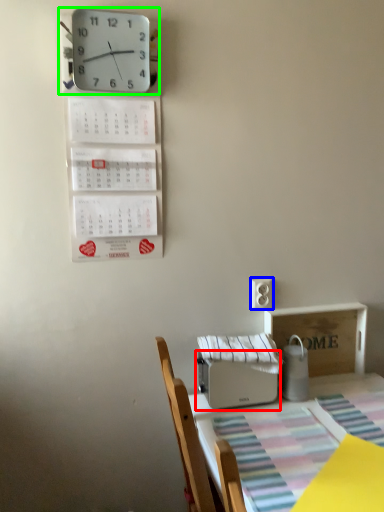
Question: Considering the real-world distances, which object is farthest from appliance (highlighted by a red box)? electric outlet (highlighted by a blue box) or wall clock (highlighted by a green box)?

Choices:
 (A) electric outlet
 (B) wall clock

Answer: (B)